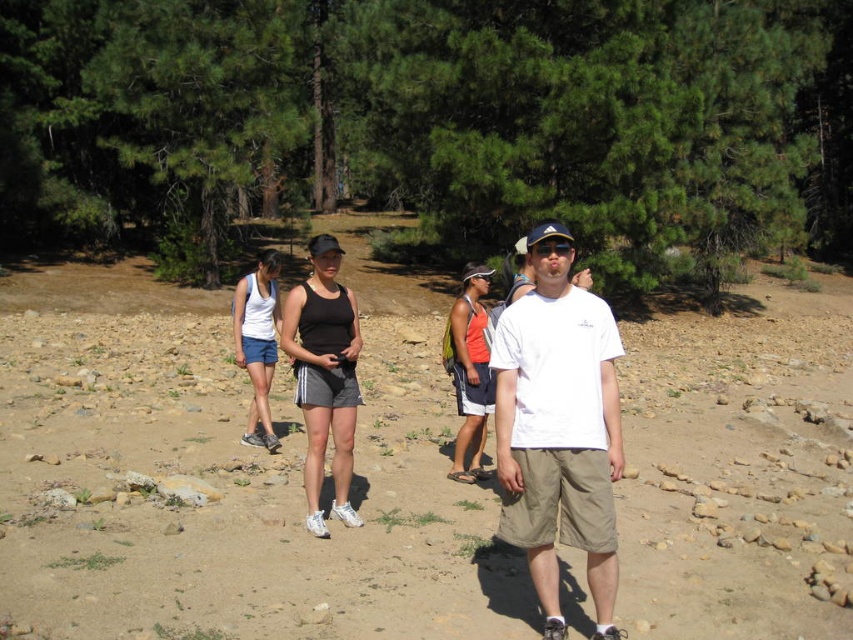
Question: Can you confirm if green leafy pine trees at upper center is smaller than orange fabric tank top at center?

Choices:
 (A) no
 (B) yes

Answer: (A)

Question: Considering the real-world distances, which object is closest to the green leafy pine trees at upper center?

Choices:
 (A) black fabric tank top at center
 (B) white cotton t-shirt at center
 (C) white fabric tank top at center

Answer: (C)

Question: Is orange fabric tank top at center thinner than white fabric tank top at center?

Choices:
 (A) yes
 (B) no

Answer: (A)

Question: Which point is farther from the camera taking this photo?

Choices:
 (A) (265, 410)
 (B) (570, 324)
 (C) (305, 381)

Answer: (A)

Question: Which point is closer to the camera?

Choices:
 (A) white cotton t-shirt at center
 (B) white fabric tank top at center

Answer: (A)

Question: Is green leafy pine trees at upper center behind black fabric tank top at center?

Choices:
 (A) yes
 (B) no

Answer: (A)